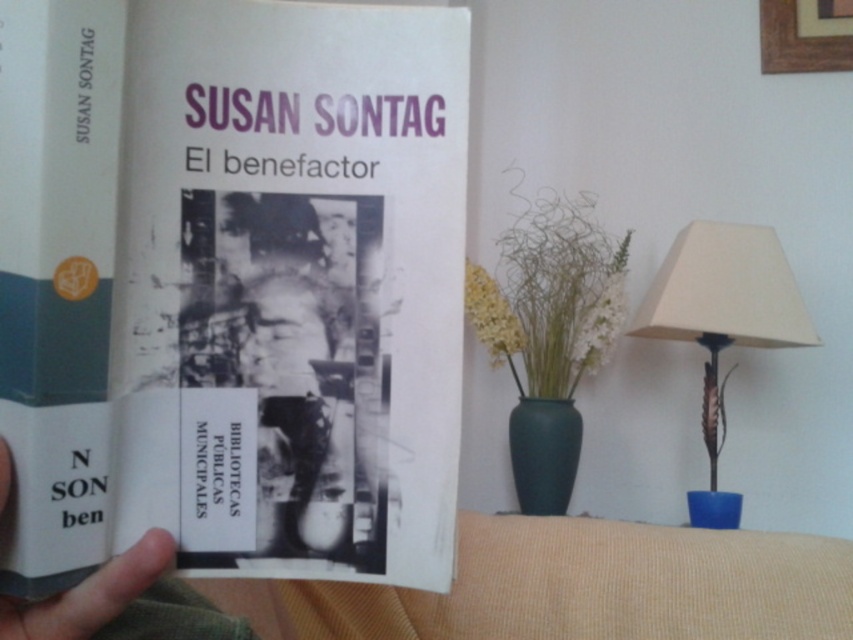
Who is more distant from viewer, (97, 320) or (157, 561)?

The point (97, 320) is behind.

Does hardcover book at center have a smaller size compared to gray matte finger at center?

Actually, hardcover book at center might be larger than gray matte finger at center.

Between point (318, 45) and point (96, 621), which one is positioned behind?

The point (318, 45) is behind.

Find the location of `hardcover book at center`. hardcover book at center is located at coordinates (231, 285).

Who is positioned more to the right, hardcover book at center or beige fabric lampshade at right?

beige fabric lampshade at right

Which is in front, point (463, 188) or point (701, 328)?

Point (463, 188) is more forward.

I want to click on hardcover book at center, so click(x=231, y=285).

Is point (654, 301) positioned before point (122, 602)?

No, it is not.

The height and width of the screenshot is (640, 853). In order to click on beige fabric lampshade at right in this screenshot , I will do `click(722, 323)`.